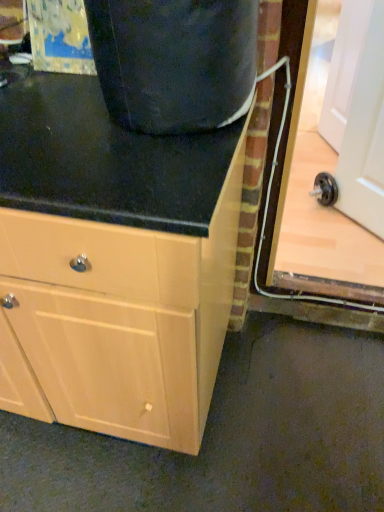
What do you see at coordinates (113, 264) in the screenshot?
I see `light wood cabinet at center` at bounding box center [113, 264].

Locate an element on the screen. This screenshot has height=512, width=384. light wood cabinet at center is located at coordinates (113, 264).

This screenshot has height=512, width=384. Find the location of `light wood cabinet at center`. light wood cabinet at center is located at coordinates (113, 264).